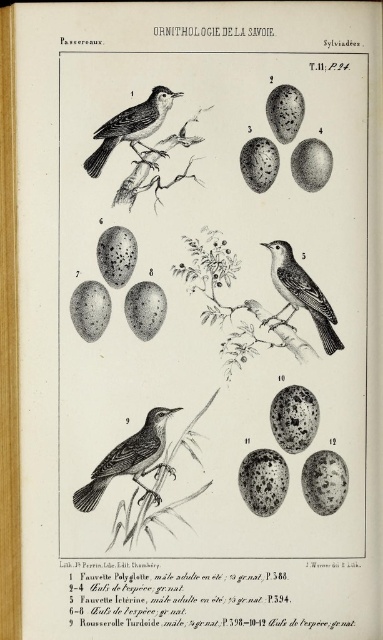
Question: Which point is farther to the camera?

Choices:
 (A) (314, 291)
 (B) (150, 429)
 (C) (135, 140)

Answer: (A)

Question: Can you confirm if brown textured bird at center is wider than smooth black bird at center?

Choices:
 (A) yes
 (B) no

Answer: (A)

Question: Considering the real-world distances, which object is farthest from the smooth black bird at center?

Choices:
 (A) smooth black bird at upper left
 (B) brown textured bird at center

Answer: (B)

Question: Is the position of brown textured bird at center less distant than that of smooth black bird at upper left?

Choices:
 (A) no
 (B) yes

Answer: (A)

Question: Does brown textured bird at center have a greater width compared to smooth black bird at upper left?

Choices:
 (A) no
 (B) yes

Answer: (B)

Question: Which point appears farthest from the camera in this image?

Choices:
 (A) (270, 244)
 (B) (116, 140)
 (C) (139, 474)

Answer: (A)